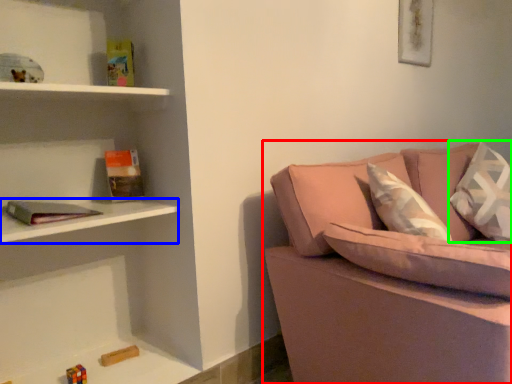
Question: Which object is the farthest from studio couch (highlighted by a red box)? Choose among these: cabinet (highlighted by a blue box) or pillow (highlighted by a green box).

Choices:
 (A) cabinet
 (B) pillow

Answer: (B)